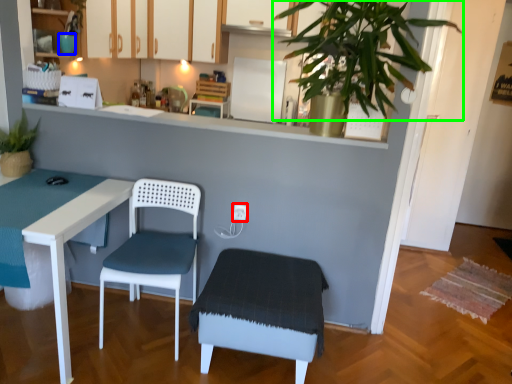
Question: Which is nearer to the electric outlet (highlighted by a red box)? teal (highlighted by a blue box) or vegetation (highlighted by a green box).

Choices:
 (A) teal
 (B) vegetation

Answer: (B)